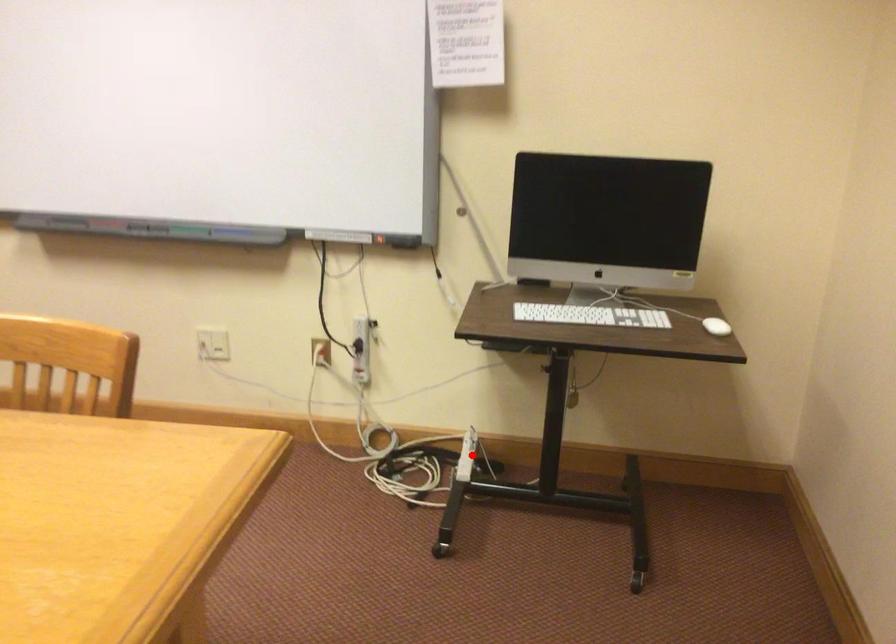
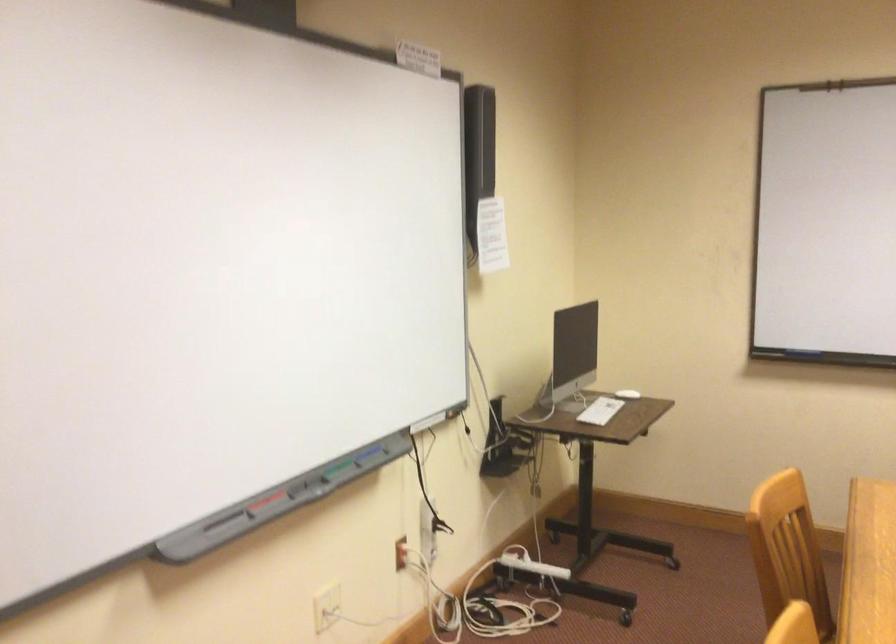
Question: A red point is marked in image1. In image2, is the corresponding 3D point closer to the camera or farther? Reply with the corresponding letter.

Choices:
 (A) The corresponding 3D point is closer.
 (B) The corresponding 3D point is farther.

Answer: (B)